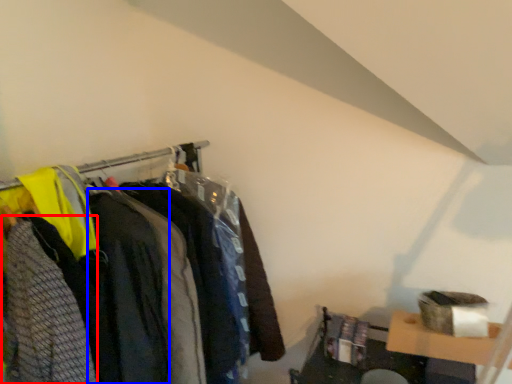
Question: Which object appears farthest to the camera in this image, clothing (highlighted by a red box) or clothing (highlighted by a blue box)?

Choices:
 (A) clothing
 (B) clothing

Answer: (B)